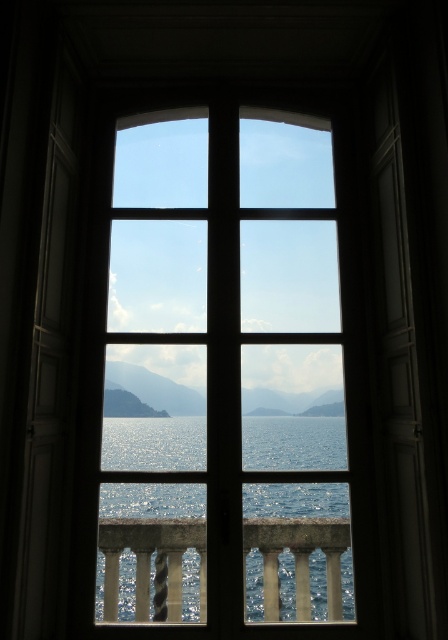
You are standing in a room and want to look out through the clear glass window at center. Which side of the polished stone balustrade at lower center should you stand on to have a better view?

To have a better view through the clear glass window at center, you should stand to the right side of the polished stone balustrade at lower center since the window is positioned to the right of the balustrade.

You are standing in a room and want to look outside through the clear glass window at center. Which direction should you face to see the window?

You should face the center direction to look through the clear glass window at center since its 2D location is at point [223,372], which is near the center of the image.

You are standing on the balcony and want to lean against the polished stone balustrade at lower center. Can you reach it without moving past the clear glass window at center?

The clear glass window at center is positioned over the polished stone balustrade at lower center, so you can reach the polished stone balustrade at lower center without moving past the window since it is below it.